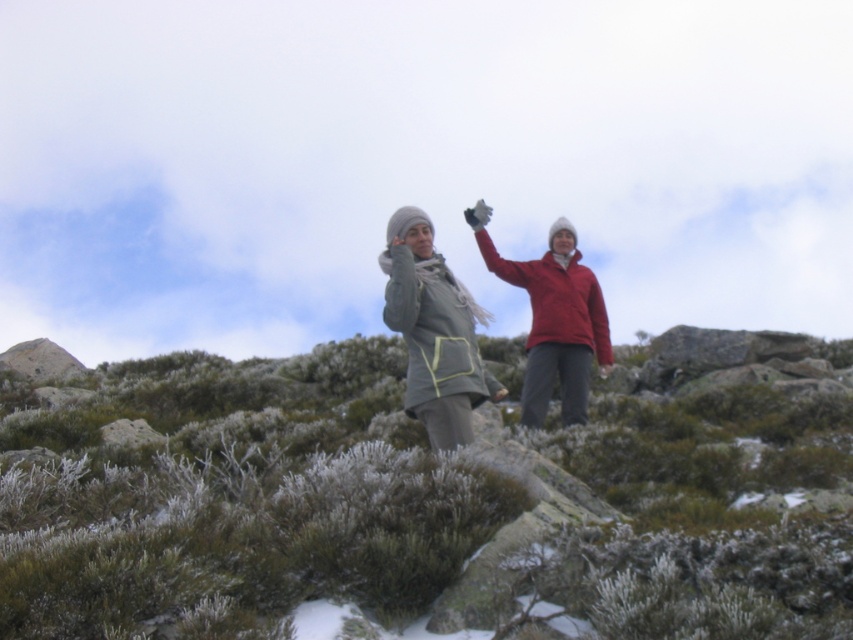
Does point (38, 493) come farther from viewer compared to point (410, 406)?

No.

Between green mossy rocks at center and matte gray jacket at center, which one is positioned higher?

matte gray jacket at center

Find the location of `green mossy rocks at center`. green mossy rocks at center is located at coordinates (416, 504).